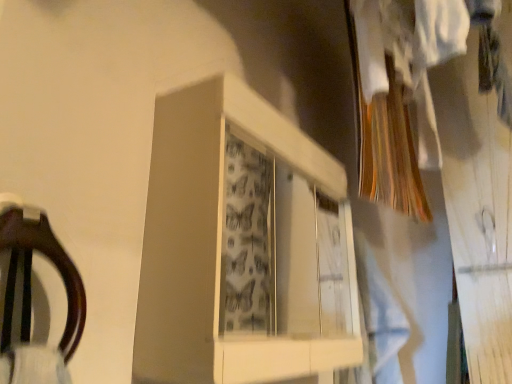
Question: Is point (371, 311) positioned closer to the camera than point (348, 339)?

Choices:
 (A) farther
 (B) closer

Answer: (A)

Question: Looking at their shapes, would you say light blue fabric at center is wider or thinner than white glossy cabinet at center?

Choices:
 (A) thin
 (B) wide

Answer: (B)

Question: In terms of height, does light blue fabric at center look taller or shorter compared to white glossy cabinet at center?

Choices:
 (A) tall
 (B) short

Answer: (A)

Question: Considering the positions of white glossy cabinet at center and light blue fabric at center in the image, is white glossy cabinet at center wider or thinner than light blue fabric at center?

Choices:
 (A) thin
 (B) wide

Answer: (A)

Question: Relative to light blue fabric at center, is white glossy cabinet at center in front or behind?

Choices:
 (A) front
 (B) behind

Answer: (A)

Question: Is white glossy cabinet at center bigger or smaller than light blue fabric at center?

Choices:
 (A) big
 (B) small

Answer: (A)

Question: From a real-world perspective, is white glossy cabinet at center positioned above or below light blue fabric at center?

Choices:
 (A) below
 (B) above

Answer: (B)